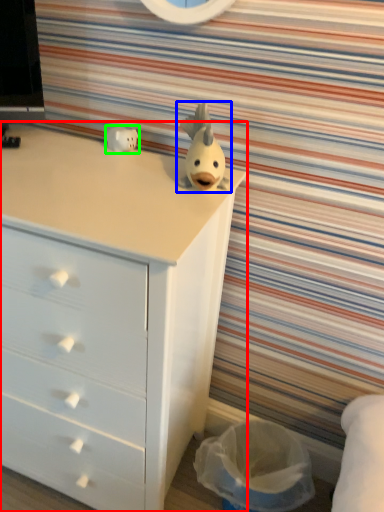
Question: Which object is the farthest from chest of drawers (highlighted by a red box)? Choose among these: toy (highlighted by a blue box) or toy (highlighted by a green box).

Choices:
 (A) toy
 (B) toy

Answer: (B)